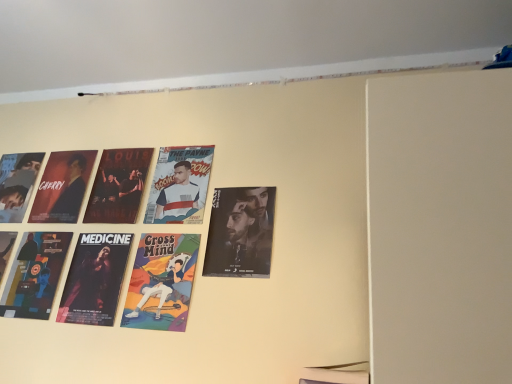
Question: Is matte black poster at left, the third person positioned from the right, at the left side of cartoon character poster at center, which appears as the 2th person when viewed from the left?

Choices:
 (A) yes
 (B) no

Answer: (A)

Question: Is matte black poster at left, the third person positioned from the right, thinner than cartoon character poster at center, which appears as the 2th person when viewed from the left?

Choices:
 (A) no
 (B) yes

Answer: (A)

Question: Is cartoon character poster at center, the second person from the right, at the back of matte black poster at left, the third person positioned from the right?

Choices:
 (A) yes
 (B) no

Answer: (B)

Question: Is the depth of matte black poster at left, the third person positioned from the right, greater than that of cartoon character poster at center, which appears as the 2th person when viewed from the left?

Choices:
 (A) no
 (B) yes

Answer: (B)

Question: Is matte black poster at left, the third person positioned from the right, aimed at cartoon character poster at center, which appears as the 2th person when viewed from the left?

Choices:
 (A) yes
 (B) no

Answer: (B)

Question: Is matte black poster at center, the 3th poster from the left, spatially inside cartoon character poster at center, the second person from the right, or outside of it?

Choices:
 (A) inside
 (B) outside

Answer: (B)

Question: Considering their positions, is matte black poster at center, the 3th poster from the left, located in front of or behind cartoon character poster at center, the second person from the right?

Choices:
 (A) behind
 (B) front

Answer: (A)

Question: Would you say matte black poster at center, acting as the first poster starting from the right, is to the left or to the right of cartoon character poster at center, the second person from the right, in the picture?

Choices:
 (A) left
 (B) right

Answer: (B)

Question: From the image's perspective, is matte black poster at center, acting as the first poster starting from the right, located above or below cartoon character poster at center, which appears as the 2th person when viewed from the left?

Choices:
 (A) above
 (B) below

Answer: (A)

Question: Considering the positions of point (247, 188) and point (79, 163), is point (247, 188) closer or farther from the camera than point (79, 163)?

Choices:
 (A) closer
 (B) farther

Answer: (A)

Question: In the image, is matte black poster at center, the 3th poster from the left, on the left side or the right side of matte black poster at left, the third person positioned from the right?

Choices:
 (A) right
 (B) left

Answer: (A)

Question: From the image's perspective, relative to matte black poster at left, the third person positioned from the right, is matte black poster at center, acting as the first poster starting from the right, above or below?

Choices:
 (A) above
 (B) below

Answer: (B)

Question: Based on their sizes in the image, would you say matte black poster at center, the 3th poster from the left, is bigger or smaller than matte black poster at left, the first person viewed from the left?

Choices:
 (A) small
 (B) big

Answer: (B)

Question: From the image's perspective, relative to white glossy poster at center, the third person in the left-to-right sequence, is matte black poster at center, acting as the first poster starting from the right, above or below?

Choices:
 (A) below
 (B) above

Answer: (A)

Question: From a real-world perspective, relative to white glossy poster at center, the third person in the left-to-right sequence, is matte black poster at center, the 3th poster from the left, vertically above or below?

Choices:
 (A) below
 (B) above

Answer: (A)